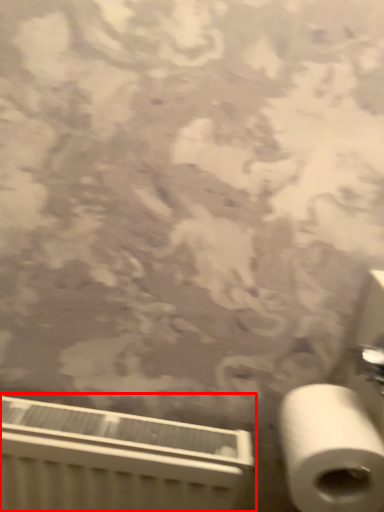
Question: Considering the relative positions of radiator (annotated by the red box) and toilet paper in the image provided, where is radiator (annotated by the red box) located with respect to the staircase?

Choices:
 (A) right
 (B) left

Answer: (B)